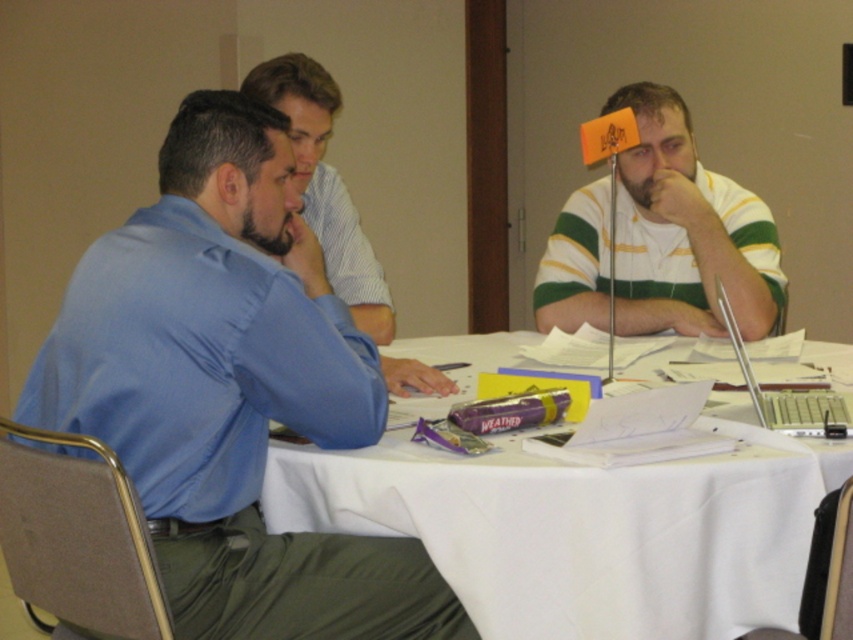
Can you confirm if white cloth table at center is wider than blue shirt at left?

Yes, white cloth table at center is wider than blue shirt at left.

Is white cloth table at center positioned in front of blue shirt at left?

Yes, white cloth table at center is closer to the viewer.

Does point (492, 602) lie in front of point (340, 273)?

Yes, it is.

This screenshot has height=640, width=853. What are the coordinates of `white cloth table at center` in the screenshot? It's located at (583, 529).

Measure the distance between blue cotton shirt at left and camera.

They are 5.35 feet apart.

Which is in front, point (196, 492) or point (753, 218)?

Point (196, 492) is more forward.

Measure the distance between point (286, 410) and camera.

1.71 meters

I want to click on blue cotton shirt at left, so click(x=231, y=390).

Looking at this image, between striped jersey at center and blue shirt at left, which one appears on the right side from the viewer's perspective?

striped jersey at center

Does striped jersey at center have a greater height compared to blue shirt at left?

Incorrect, striped jersey at center's height is not larger of blue shirt at left's.

Is point (732, 300) positioned behind point (338, 221)?

No, it is not.

Where is `striped jersey at center`? This screenshot has width=853, height=640. striped jersey at center is located at coordinates (686, 230).